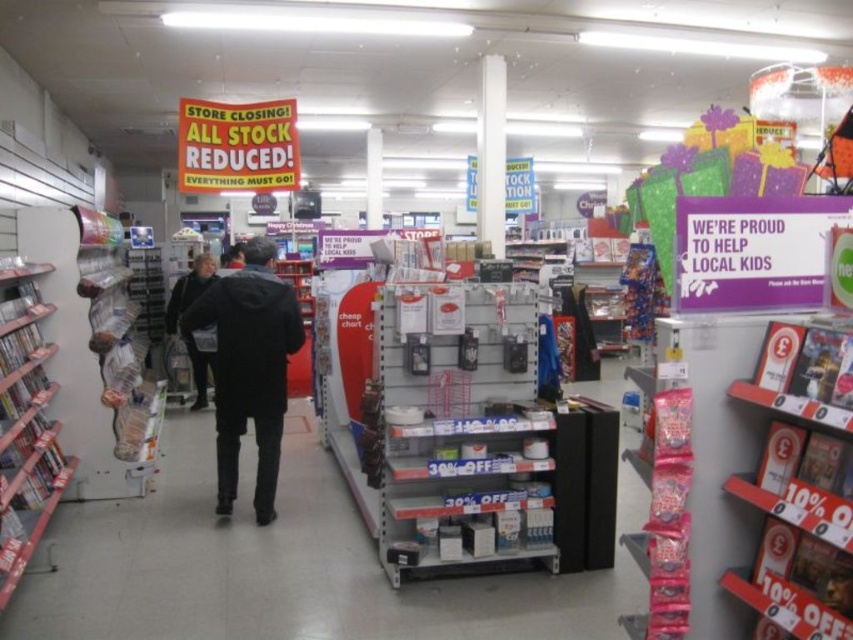
You are a customer browsing the store and want to grab both the black matte jacket at center and the dark gray sweater at center. Which item should you pick up first if you want to start from the left side of the store?

You should pick up the dark gray sweater at center first since it is located to the left of the black matte jacket at center.

You are a customer holding a 1.5 meter long ladder. You need to reach the top shelf to get an item. The black matte jacket at center and the dark gray sweater at center are in your way. Can you fit the ladder between them?

The black matte jacket at center is 2.88 meters away from the dark gray sweater at center. Since the ladder is 1.5 meters long, it can fit between them as the distance between the two items is greater than the ladder length.

Please look at the image of the retail store. There is a point marked at coordinates (248, 368). What object in the store corresponds to this point?

The point at coordinates (248, 368) corresponds to the black matte jacket at center.